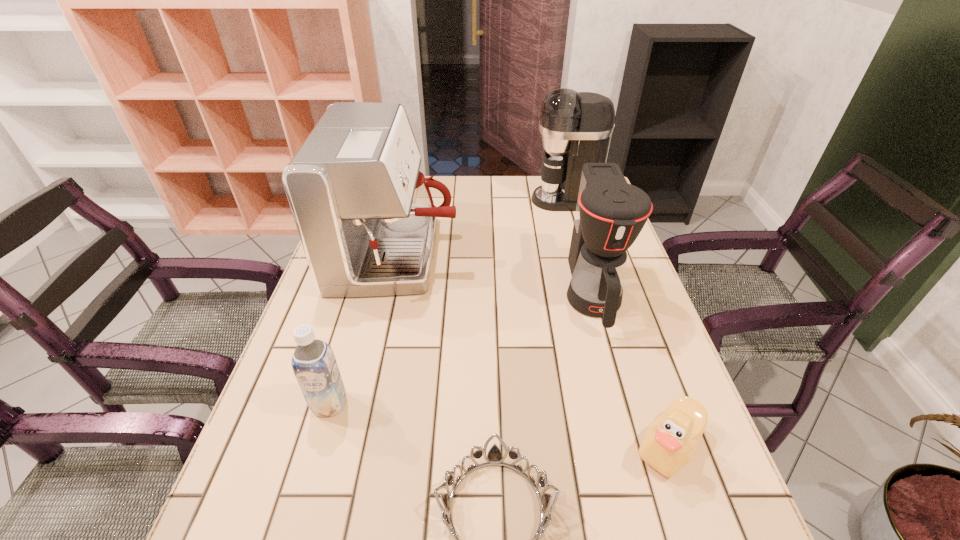
The image size is (960, 540). Find the location of `vacant space situated 0.070m on the label of the soya milk`. vacant space situated 0.070m on the label of the soya milk is located at coordinates (315, 453).

Locate an element on the screen. Image resolution: width=960 pixels, height=540 pixels. free space located at the beak of the duck is located at coordinates (422, 446).

At what (x,y) coordinates should I click in order to perform the action: click on free space located 0.340m at the beak of the duck. Please return your answer as a coordinate pair (x, y). This screenshot has width=960, height=540. Looking at the image, I should click on (449, 446).

At what (x,y) coordinates should I click in order to perform the action: click on vacant space located at the beak of the duck. Please return your answer as a coordinate pair (x, y). Looking at the image, I should click on (579, 446).

Find the location of a particular element. object present at the far edge is located at coordinates (576, 127).

Where is `coffee maker that is at the left edge`? The image size is (960, 540). coffee maker that is at the left edge is located at coordinates (365, 215).

Locate an element on the screen. soya milk that is at the left edge is located at coordinates coord(315,368).

This screenshot has height=540, width=960. Find the location of `duck that is at the right edge`. duck that is at the right edge is located at coordinates (670, 442).

Identify the location of object present at the far right corner. (576, 127).

The width and height of the screenshot is (960, 540). Find the location of `free space at the far edge`. free space at the far edge is located at coordinates (467, 208).